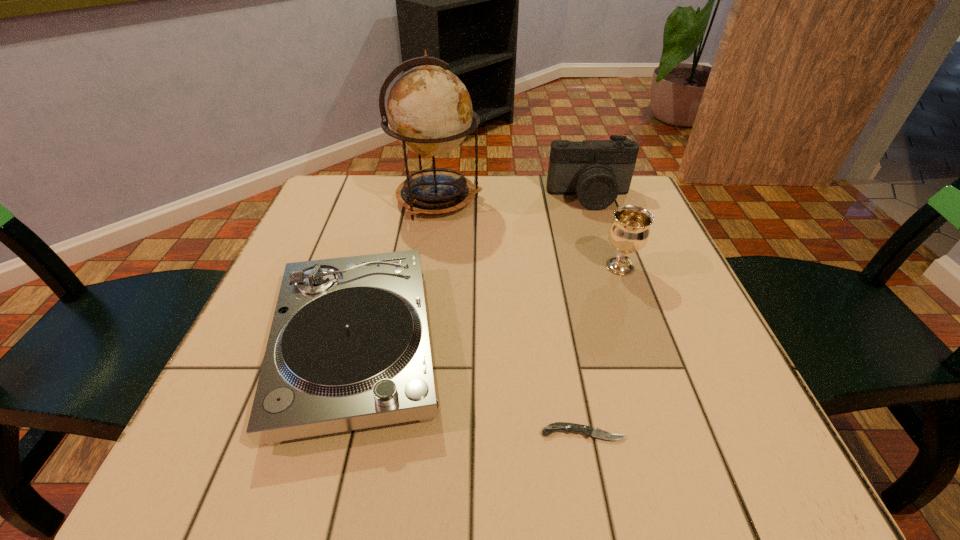
You are a GUI agent. You are given a task and a screenshot of the screen. Output one action in this format:
    pyautogui.click(x=<x>, y=<y>)
    Task: Click on the globe
    
    Given the screenshot: What is the action you would take?
    pyautogui.click(x=429, y=110)

Where is `camera`? camera is located at coordinates (597, 171).

This screenshot has height=540, width=960. Identify the location of chalice. (629, 232).

At what (x,y) coordinates should I click in order to perform the action: click on the second shortest object. Please return your answer as a coordinate pair (x, y). Looking at the image, I should click on (349, 348).

This screenshot has width=960, height=540. What are the coordinates of `pocketknife` in the screenshot? It's located at (587, 431).

Find the location of a particular element. Image resolution: width=960 pixels, height=540 pixels. blank area located at the center of the globe is located at coordinates (604, 199).

Image resolution: width=960 pixels, height=540 pixels. Find the location of `vacant space located 0.370m at the lens of the camera`. vacant space located 0.370m at the lens of the camera is located at coordinates (633, 322).

Where is `vacant space located on the front of the chalice`? The width and height of the screenshot is (960, 540). vacant space located on the front of the chalice is located at coordinates (684, 446).

Find the location of a particular element. blank space located on the right of the record player is located at coordinates (479, 345).

Identify the location of free space located 0.050m on the left of the pocketknife. Image resolution: width=960 pixels, height=540 pixels. (507, 433).